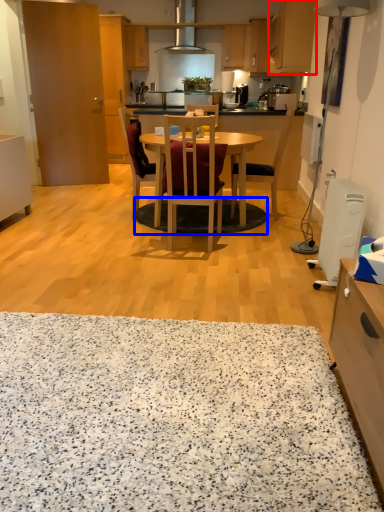
Question: Which object is closer to the camera taking this photo, cabinetry (highlighted by a red box) or mat (highlighted by a blue box)?

Choices:
 (A) cabinetry
 (B) mat

Answer: (B)